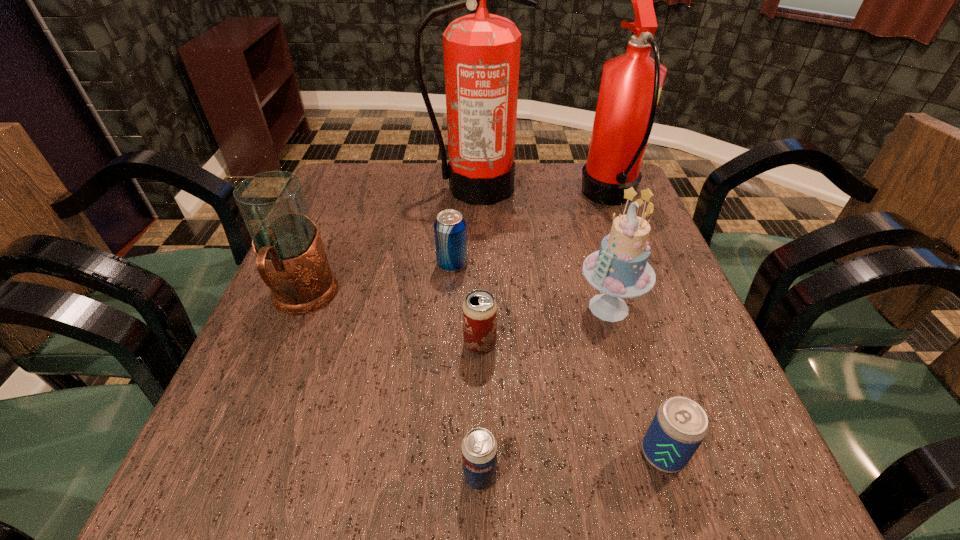
Where is `vacant area situated 0.330m at the spray nozzle of the right fire extinguisher`? vacant area situated 0.330m at the spray nozzle of the right fire extinguisher is located at coordinates (460, 198).

The image size is (960, 540). Identify the location of free location located 0.380m with a ladder on the side of the cake. (390, 307).

Locate an element on the screen. vacant region located 0.280m with a ladder on the side of the cake is located at coordinates (439, 307).

Where is `vacant space located 0.090m with a ladder on the side of the cake`? vacant space located 0.090m with a ladder on the side of the cake is located at coordinates (532, 307).

This screenshot has height=540, width=960. Find the location of `vacant space located with the handle on the side of the pitcher`. vacant space located with the handle on the side of the pitcher is located at coordinates (258, 408).

The height and width of the screenshot is (540, 960). What are the coordinates of `vacant space located 0.170m on the front of the farthest beer can` in the screenshot? It's located at (447, 335).

In order to click on vacant space located on the back of the third nearest beer can in this screenshot , I will do `click(480, 275)`.

The width and height of the screenshot is (960, 540). Identify the location of vacant region located on the back of the rightmost beer can. (641, 384).

Locate an element on the screen. object that is at the left edge is located at coordinates (291, 260).

This screenshot has height=540, width=960. What are the coordinates of `fire extinguisher that is at the right edge` in the screenshot? It's located at (631, 84).